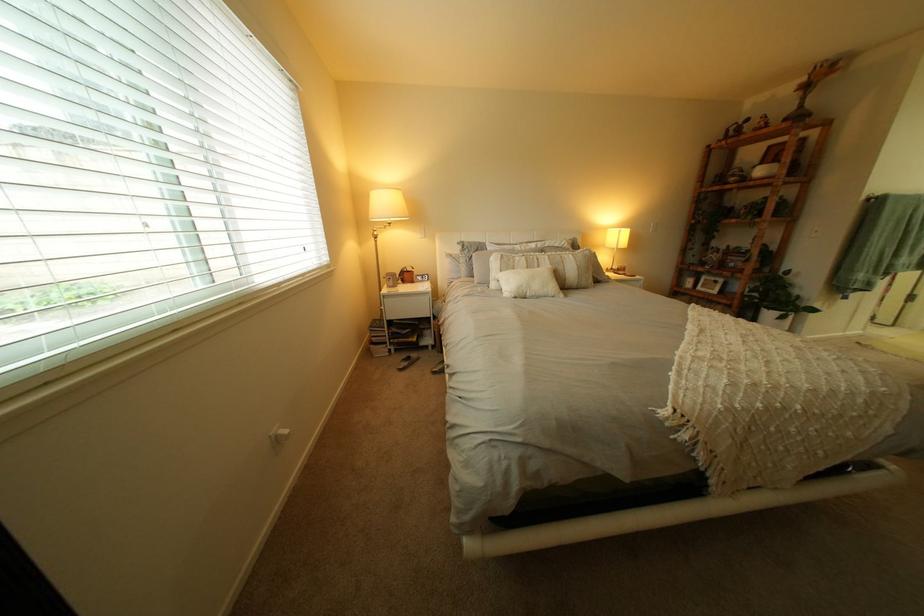
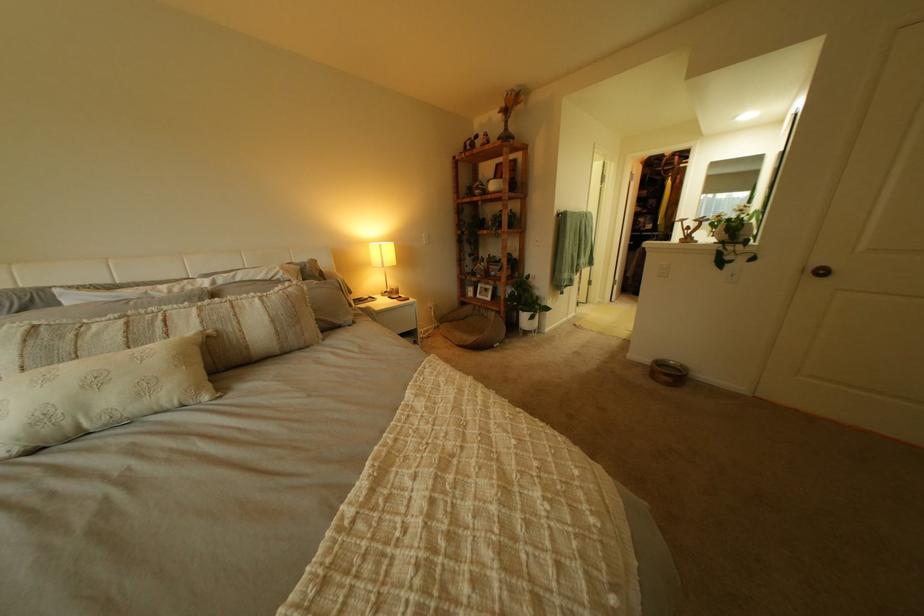
The point at (564, 264) is marked in the first image. Where is the corresponding point in the second image?

(213, 323)